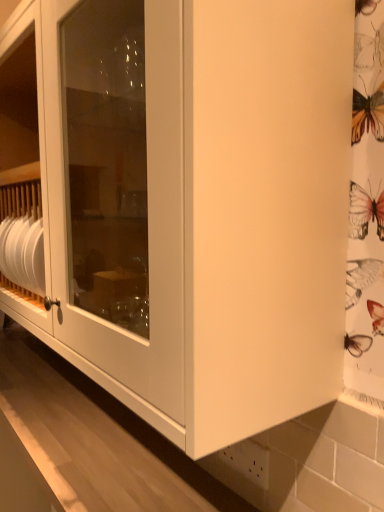
Where is `white glossy tile at lower right`? white glossy tile at lower right is located at coordinates (248, 461).

The width and height of the screenshot is (384, 512). Describe the element at coordinates (248, 461) in the screenshot. I see `white glossy tile at lower right` at that location.

The width and height of the screenshot is (384, 512). I want to click on white glossy tile at lower right, so click(248, 461).